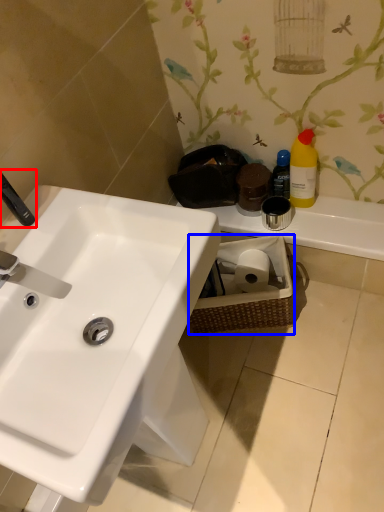
Question: Which object appears closest to the camera in this image, plumbing fixture (highlighted by a red box) or basket (highlighted by a blue box)?

Choices:
 (A) plumbing fixture
 (B) basket

Answer: (A)